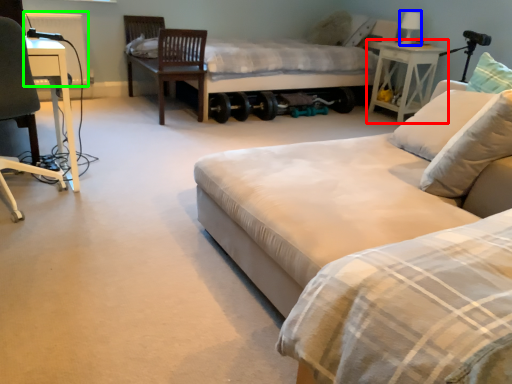
Question: Which object is the closest to the nightstand (highlighted by a red box)? Choose among these: table lamp (highlighted by a blue box) or radiator (highlighted by a green box).

Choices:
 (A) table lamp
 (B) radiator

Answer: (A)